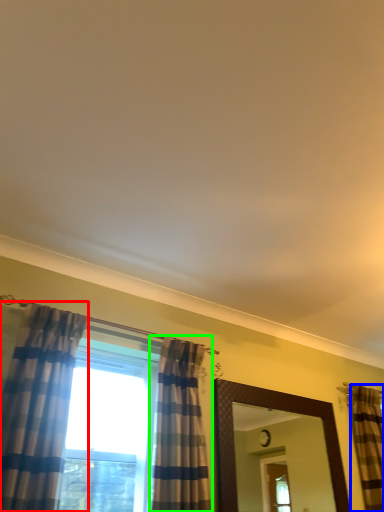
Question: Considering the real-world distances, which object is closest to curtain (highlighted by a red box)? curtain (highlighted by a blue box) or curtain (highlighted by a green box).

Choices:
 (A) curtain
 (B) curtain

Answer: (B)